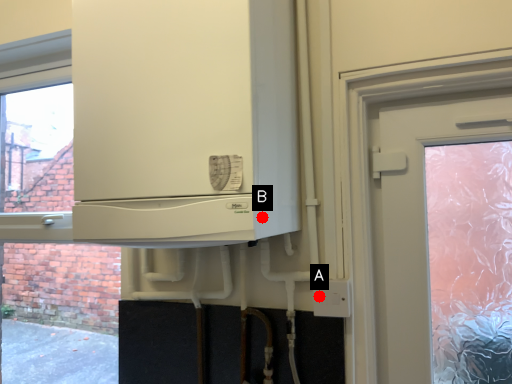
Question: Two points are circled on the image, labeled by A and B beside each circle. Which of the following is the closest to the observer?

Choices:
 (A) A is closer
 (B) B is closer

Answer: (B)